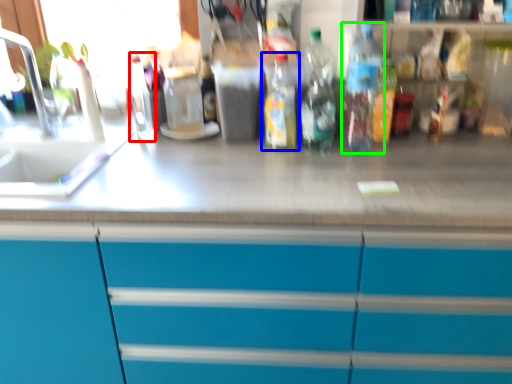
Question: Which object is the closest to the bottle (highlighted by a red box)? Choose among these: bottle (highlighted by a blue box) or bottle (highlighted by a green box).

Choices:
 (A) bottle
 (B) bottle

Answer: (A)